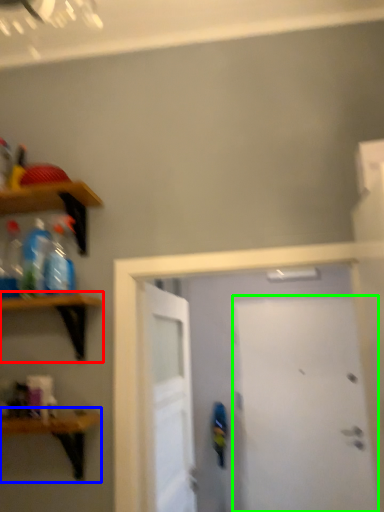
Question: Which object is the closest to the shelf (highlighted by a red box)? Choose among these: shelf (highlighted by a blue box) or door (highlighted by a green box).

Choices:
 (A) shelf
 (B) door

Answer: (A)